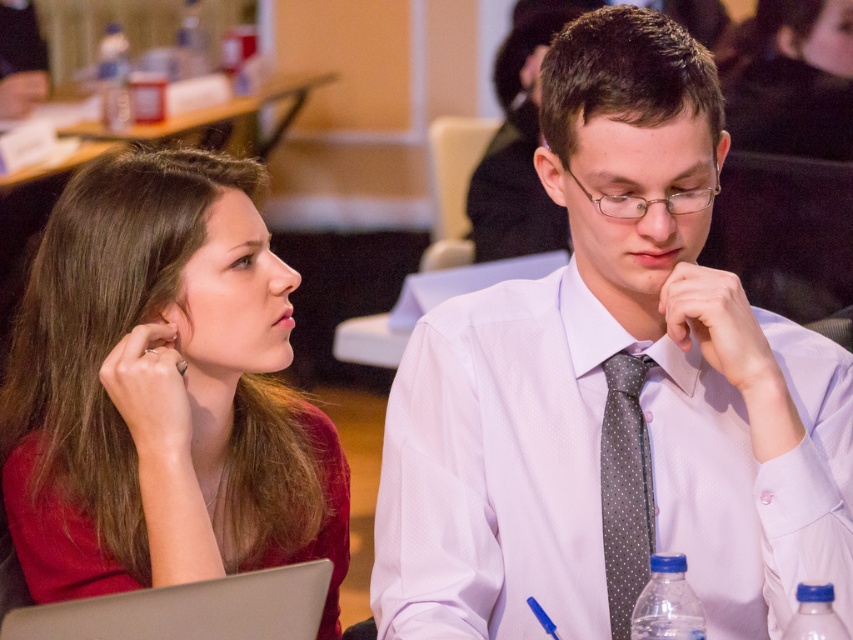
Question: Which point is farther to the camera?

Choices:
 (A) matte red shirt at left
 (B) gray dotted tie at center
 (C) silver metallic laptop at lower left

Answer: (A)

Question: Which is nearer to the white dotted tie at center?

Choices:
 (A) matte red shirt at left
 (B) gray dotted tie at center
 (C) silver metallic laptop at lower left

Answer: (B)

Question: Can you confirm if white dotted tie at center is smaller than matte red shirt at left?

Choices:
 (A) yes
 (B) no

Answer: (A)

Question: Can you confirm if matte red shirt at left is positioned below silver metallic laptop at lower left?

Choices:
 (A) yes
 (B) no

Answer: (B)

Question: Can you confirm if white dotted tie at center is positioned to the left of gray dotted tie at center?

Choices:
 (A) no
 (B) yes

Answer: (A)

Question: Among these points, which one is farthest from the camera?

Choices:
 (A) (614, 492)
 (B) (39, 330)
 (C) (660, 28)
 (D) (190, 637)

Answer: (B)